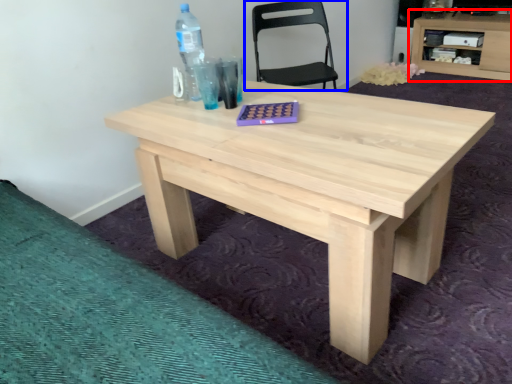
Question: Among these objects, which one is farthest to the camera, computer desk (highlighted by a red box) or chair (highlighted by a blue box)?

Choices:
 (A) computer desk
 (B) chair

Answer: (A)